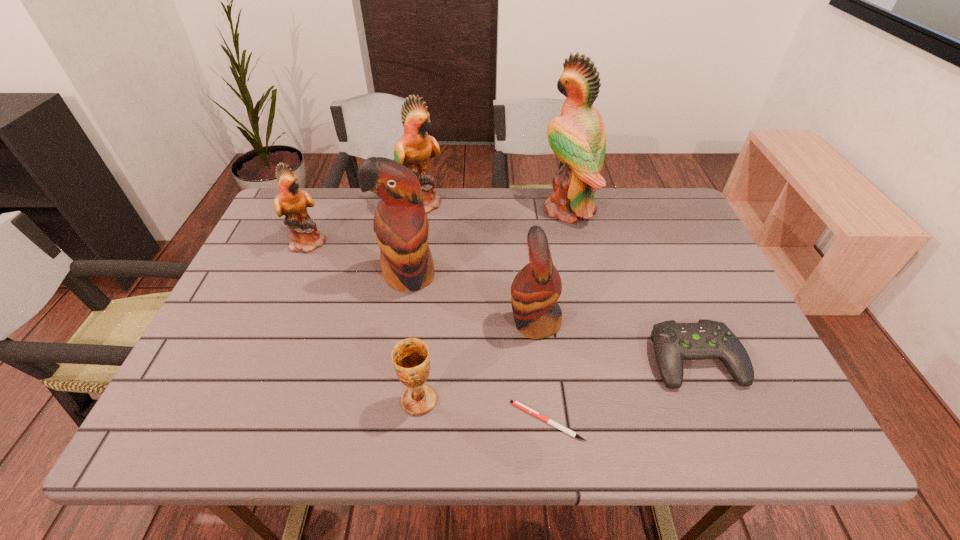
At what (x,y) coordinates should I click in order to perform the action: click on free space between the sixth tallest object and the pen. Please return your answer as a coordinate pair (x, y). This screenshot has height=540, width=960. Looking at the image, I should click on (483, 411).

I want to click on free spot between the white pen and the chalice, so click(x=483, y=411).

The height and width of the screenshot is (540, 960). Find the location of `free space between the second green parrot from right to left and the shortest object`. free space between the second green parrot from right to left and the shortest object is located at coordinates (485, 312).

The height and width of the screenshot is (540, 960). Identify the location of vacant area that lies between the bigger red parrot and the nearest parrot. (471, 299).

The image size is (960, 540). I want to click on empty space between the second biggest green parrot and the pen, so click(x=485, y=312).

Locate which object is the fifth closest to the tallest object. Please provide its 2D coordinates. Your answer should be formatted as a tuple, i.e. [(x, y)], where the tuple contains the x and y coordinates of a point satisfying the conditions above.

[(517, 404)]

Select which object is the closest to the third shortest object. Please provide its 2D coordinates. Your answer should be formatted as a tuple, i.e. [(x, y)], where the tuple contains the x and y coordinates of a point satisfying the conditions above.

[(517, 404)]

Select which parrot is the closest to the leftmost object. Please provide its 2D coordinates. Your answer should be formatted as a tuple, i.e. [(x, y)], where the tuple contains the x and y coordinates of a point satisfying the conditions above.

[(401, 228)]

Point out which parrot is positioned as the second nearest to the tallest object. Please provide its 2D coordinates. Your answer should be formatted as a tuple, i.e. [(x, y)], where the tuple contains the x and y coordinates of a point satisfying the conditions above.

[(413, 149)]

Where is `green parrot that is the nearest to the second green parrot from right to left`? green parrot that is the nearest to the second green parrot from right to left is located at coordinates (292, 202).